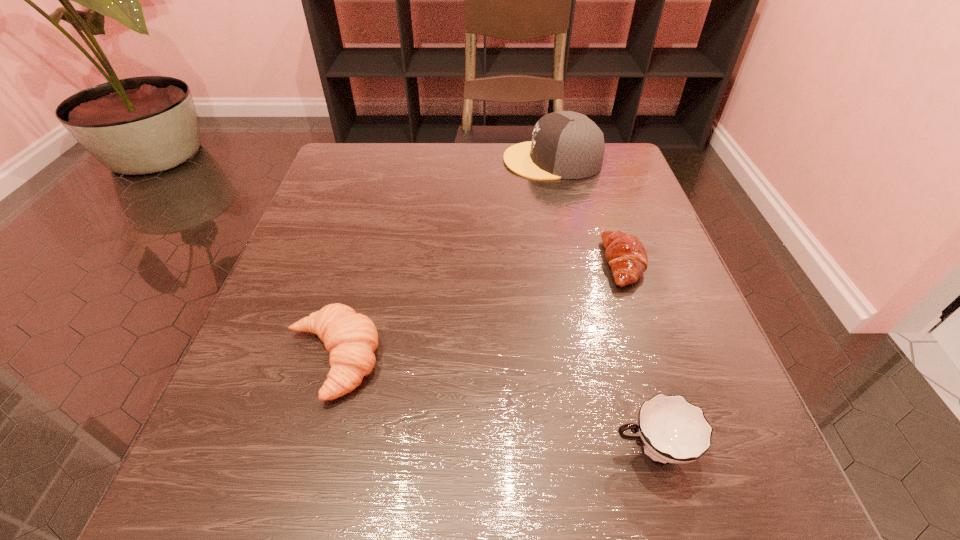
Locate an element on the screen. The height and width of the screenshot is (540, 960). the farthest object is located at coordinates (565, 145).

The width and height of the screenshot is (960, 540). Find the location of `cap`. cap is located at coordinates (565, 145).

At what (x,y) coordinates should I click in order to perform the action: click on the nearest object. Please return your answer as a coordinate pair (x, y). The height and width of the screenshot is (540, 960). Looking at the image, I should click on (672, 430).

Where is `the left crescent roll`? This screenshot has width=960, height=540. the left crescent roll is located at coordinates (351, 338).

The width and height of the screenshot is (960, 540). In order to click on the leftmost object in this screenshot , I will do `click(351, 338)`.

Locate an element on the screen. This screenshot has width=960, height=540. the right crescent roll is located at coordinates click(x=625, y=254).

Image resolution: width=960 pixels, height=540 pixels. In order to click on the farther crescent roll in this screenshot , I will do pyautogui.click(x=625, y=254).

Identify the location of vacant space located 0.080m on the front-facing side of the tallest object. The height and width of the screenshot is (540, 960). (470, 160).

This screenshot has height=540, width=960. Identify the location of vacant area situated on the front-facing side of the tallest object. (375, 160).

Locate an element on the screen. The image size is (960, 540). free spot located 0.140m on the front-facing side of the tallest object is located at coordinates (445, 160).